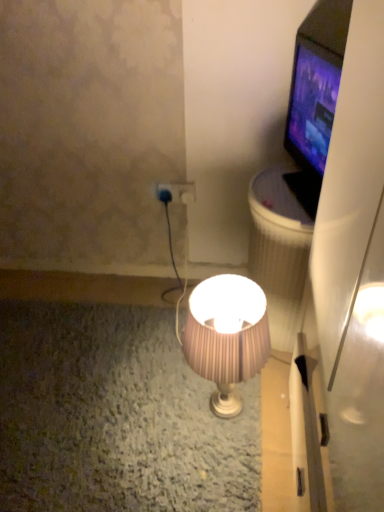
Question: Do you think pink pleated fabric lampshade at center is within blue plastic plug at center, or outside of it?

Choices:
 (A) inside
 (B) outside

Answer: (B)

Question: Looking at their shapes, would you say pink pleated fabric lampshade at center is wider or thinner than blue plastic plug at center?

Choices:
 (A) thin
 (B) wide

Answer: (B)

Question: Estimate the real-world distances between objects in this image. Which object is closer to the white textured trash can at right?

Choices:
 (A) blue plastic plug at center
 (B) matte black tv at upper right
 (C) pink pleated fabric lampshade at center

Answer: (B)

Question: Which object is positioned closest to the pink pleated fabric lampshade at center?

Choices:
 (A) blue plastic plug at center
 (B) matte black tv at upper right
 (C) white textured trash can at right

Answer: (C)